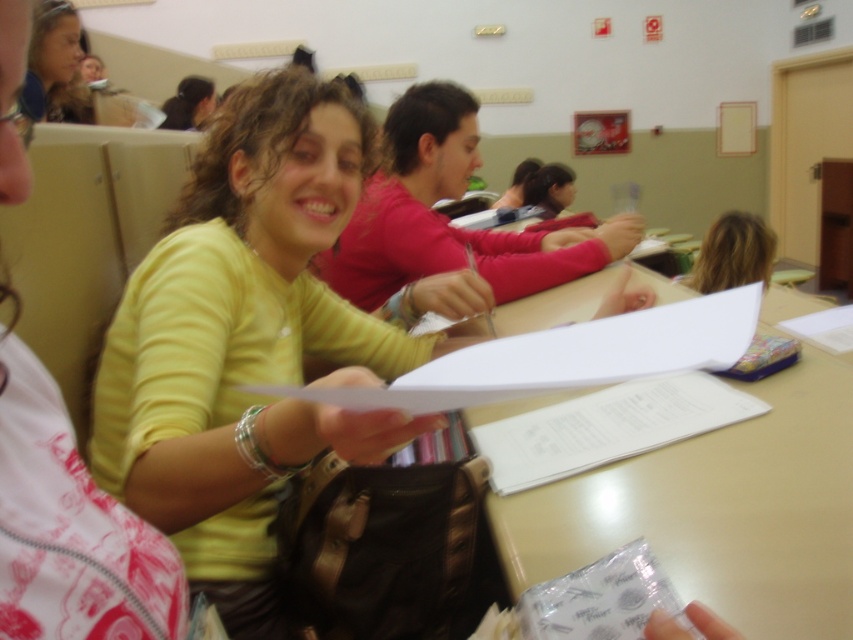
Which is in front, point (136, 394) or point (39, 36)?

Point (136, 394)

Can you confirm if yellow matte sweater at center is wider than matte yellow shirt at upper left?

In fact, yellow matte sweater at center might be narrower than matte yellow shirt at upper left.

This screenshot has height=640, width=853. I want to click on yellow matte sweater at center, so click(247, 342).